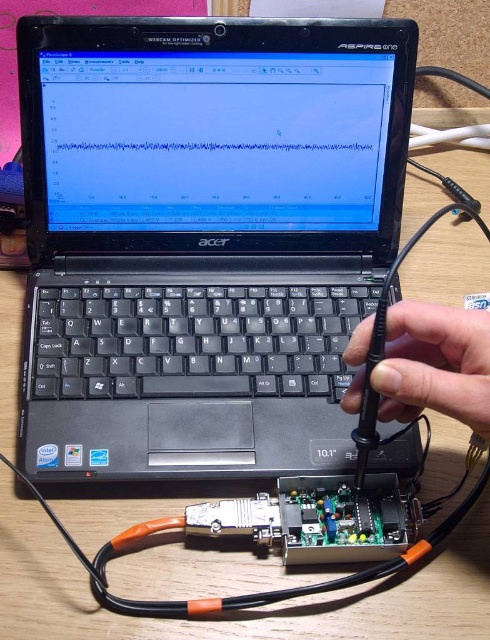
You are a technician holding a 12 inch long tool. You need to place it on the desk near the black plastic laptop at center without moving the laptop. Is there enough space between the laptop and the edge of the desk to place the tool horizontally?

The black plastic laptop at center is 21.73 inches away from the camera. Since the tool is 12 inches long, there is sufficient space between the laptop and the desk edge to place the tool horizontally as long as the desk extends at least 12 inches beyond the laptop.

You are a technician working at the desk with the laptop. You need to place a tool at the point that is closer to you. Which point should you choose between point [124,54] and point [412,349]?

Point [412,349] is closer to you because it is in front of point [124,54].

You are a technician trying to place the black plastic hand at center onto the black plastic laptop at center. Based on their sizes, will the hand fit completely on the laptop?

The black plastic laptop at center has a larger size compared to black plastic hand at center, so the hand should fit completely on the laptop.